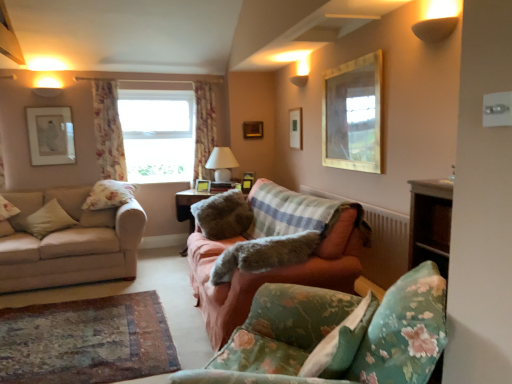
Locate an element on the screen. free spot above gold textured picture frame at upper right, which appears as the 1th picture frame when viewed from the right (from a real-world perspective) is located at coordinates (352, 57).